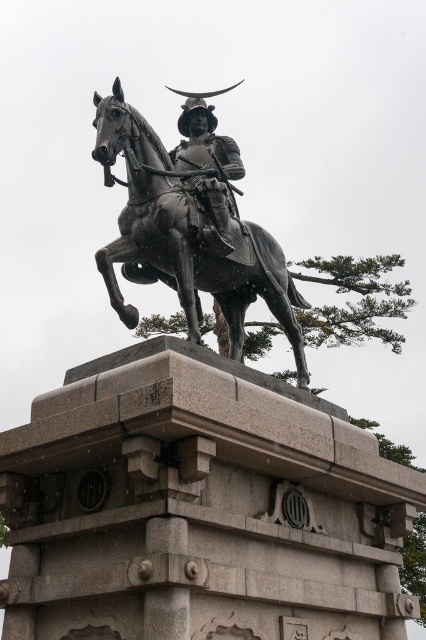
Question: Can you confirm if shiny black horse at center is positioned to the left of polished bronze helmet at center?

Choices:
 (A) no
 (B) yes

Answer: (A)

Question: Which object appears closest to the camera in this image?

Choices:
 (A) polished bronze helmet at center
 (B) shiny black horse at center

Answer: (B)

Question: Is shiny black horse at center positioned before polished bronze helmet at center?

Choices:
 (A) yes
 (B) no

Answer: (A)

Question: Can you confirm if shiny black horse at center is positioned below polished bronze helmet at center?

Choices:
 (A) no
 (B) yes

Answer: (B)

Question: Which point appears farthest from the camera in this image?

Choices:
 (A) (265, 275)
 (B) (172, 160)

Answer: (B)